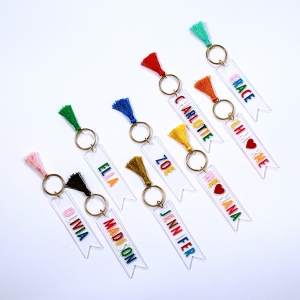
Where is `teal tassel`? This screenshot has width=300, height=300. teal tassel is located at coordinates (205, 30).